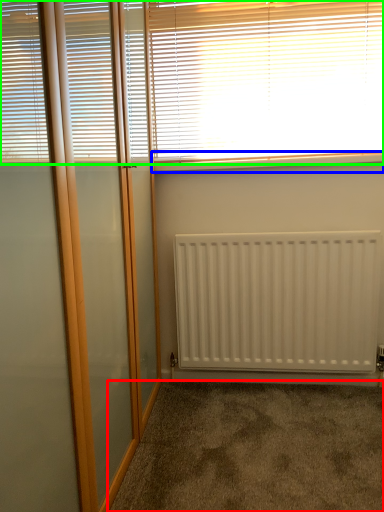
Question: Which is nearer to the corridor (highlighted by a red box)? window sill (highlighted by a blue box) or window blind (highlighted by a green box).

Choices:
 (A) window sill
 (B) window blind

Answer: (A)